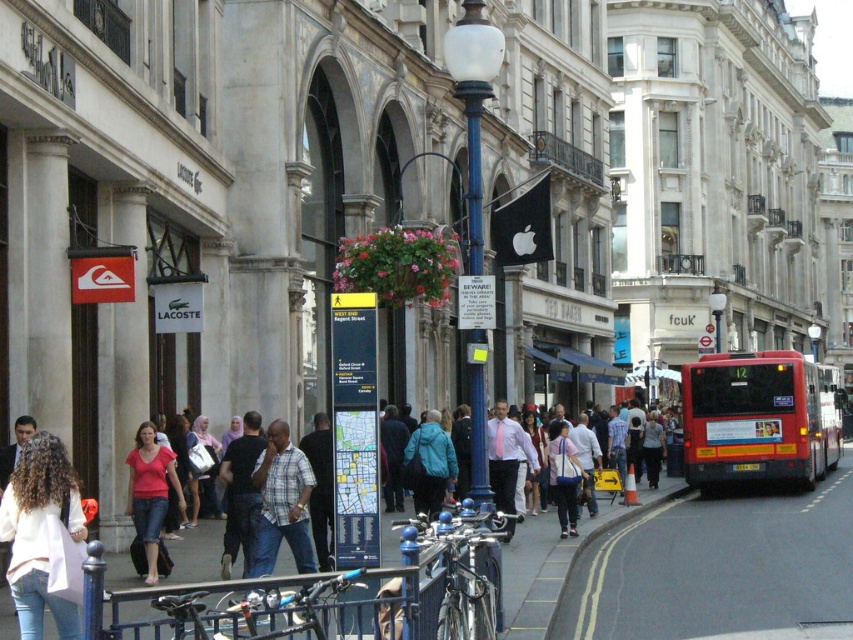
You are standing on the bustling urban street scene in front of the Lacoste storefront. You see two points marked in the image. Which point, point [437,429] or point [833,464], is closer to you?

Point [437,429] is closer to you than point [833,464] because it is closer to the camera.

You are standing at the center of the street looking forward. Which direction should you turn to see the red rubber bus at right?

The red rubber bus at right is located at point (759,419) in 2D coordinates, so you should turn to your right to face the direction of the red rubber bus at right.